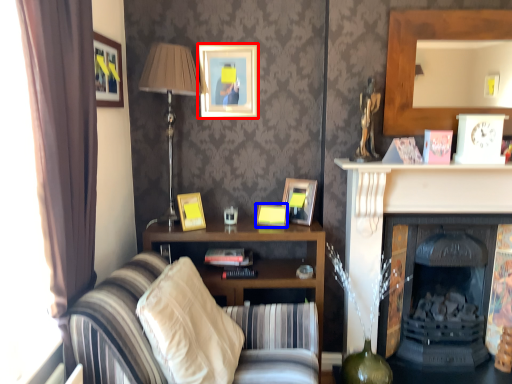
Question: Among these objects, which one is farthest to the camera, picture frame (highlighted by a red box) or picture frame (highlighted by a blue box)?

Choices:
 (A) picture frame
 (B) picture frame

Answer: (A)